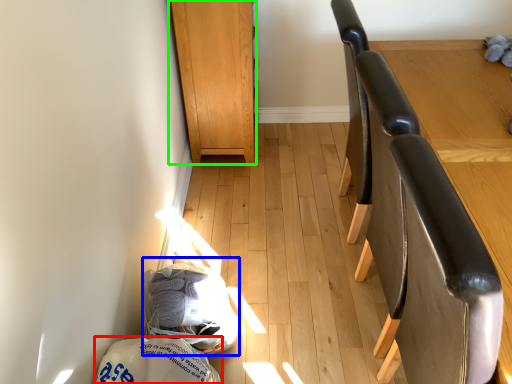
Question: Which object is positioned farthest from material (highlighted by a red box)? Select from material (highlighted by a blue box) and furniture (highlighted by a green box).

Choices:
 (A) material
 (B) furniture

Answer: (B)